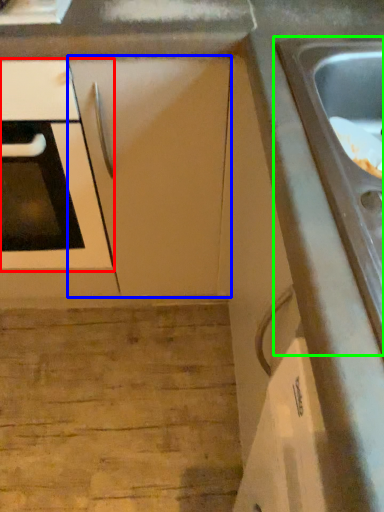
Question: Which object is positioned farthest from oven (highlighted by a red box)? Select from cabinetry (highlighted by a blue box) and sink (highlighted by a green box).

Choices:
 (A) cabinetry
 (B) sink

Answer: (B)